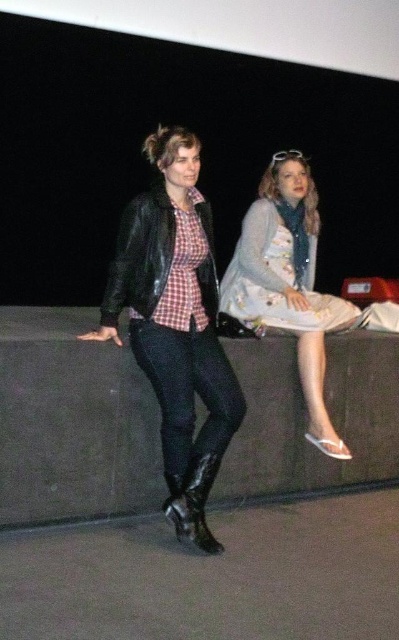
Is floral dress at center closer to the viewer compared to glossy leather boot at lower left?

No, it is behind glossy leather boot at lower left.

Is floral dress at center to the right of glossy leather boot at lower left from the viewer's perspective?

Yes, floral dress at center is to the right of glossy leather boot at lower left.

Image resolution: width=399 pixels, height=640 pixels. Identify the location of floral dress at center. (288, 282).

You are a GUI agent. You are given a task and a screenshot of the screen. Output one action in this format:
    pyautogui.click(x=<x>, y=<y>)
    Task: Click on the floral dress at center
    The height and width of the screenshot is (640, 399).
    Given the screenshot: What is the action you would take?
    pyautogui.click(x=288, y=282)

Does matte black leather jacket at left appear on the right side of glossy leather boot at lower left?

In fact, matte black leather jacket at left is to the left of glossy leather boot at lower left.

Between point (132, 314) and point (203, 504), which one is positioned behind?

The point (132, 314) is behind.

You are a GUI agent. You are given a task and a screenshot of the screen. Output one action in this format:
    pyautogui.click(x=<x>, y=<y>)
    Task: Click on the matte black leather jacket at left
    This screenshot has height=640, width=399.
    Given the screenshot: What is the action you would take?
    pyautogui.click(x=175, y=324)

This screenshot has width=399, height=640. Find the location of `matte black leather jacket at left`. matte black leather jacket at left is located at coordinates (175, 324).

Based on the photo, who is more distant from viewer, (199, 522) or (274, 256)?

Positioned behind is point (274, 256).

Describe the element at coordinates (175, 324) in the screenshot. I see `matte black leather jacket at left` at that location.

This screenshot has width=399, height=640. I want to click on matte black leather jacket at left, so [x=175, y=324].